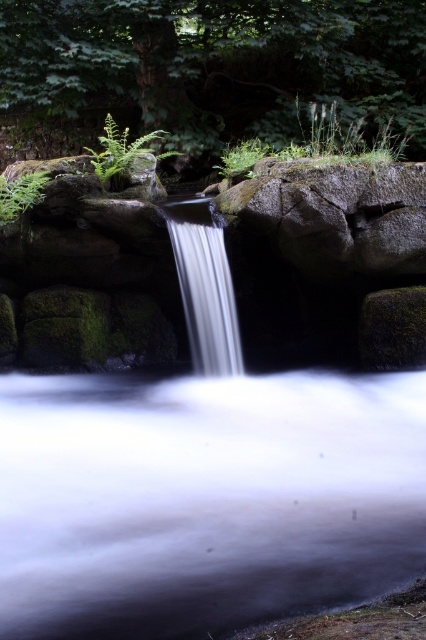
Question: Does green leafy tree at upper center appear under white smooth waterfall at center?

Choices:
 (A) no
 (B) yes

Answer: (A)

Question: Which object appears farthest from the camera in this image?

Choices:
 (A) green fuzzy fern at upper center
 (B) green matte fern at upper left

Answer: (B)

Question: Is white smooth waterfall at center positioned behind green fuzzy fern at upper center?

Choices:
 (A) no
 (B) yes

Answer: (A)

Question: Estimate the real-world distances between objects in this image. Which object is farther from the green fuzzy fern at upper center?

Choices:
 (A) green matte fern at upper left
 (B) green leafy tree at upper center
 (C) gray rough rock at center
 (D) white frothy water at center

Answer: (D)

Question: Is white frothy water at center below green fuzzy fern at upper left?

Choices:
 (A) no
 (B) yes

Answer: (B)

Question: Which of these objects is positioned closest to the green matte fern at upper left?

Choices:
 (A) white smooth waterfall at center
 (B) white frothy water at center

Answer: (A)